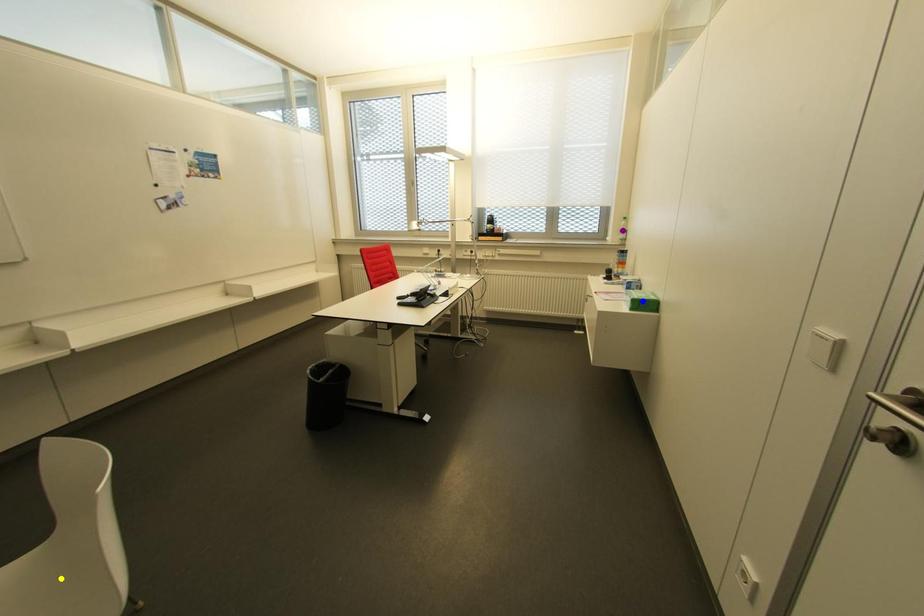
Order these from nearest to farthest:
blue point, yellow point, purple point

1. yellow point
2. blue point
3. purple point